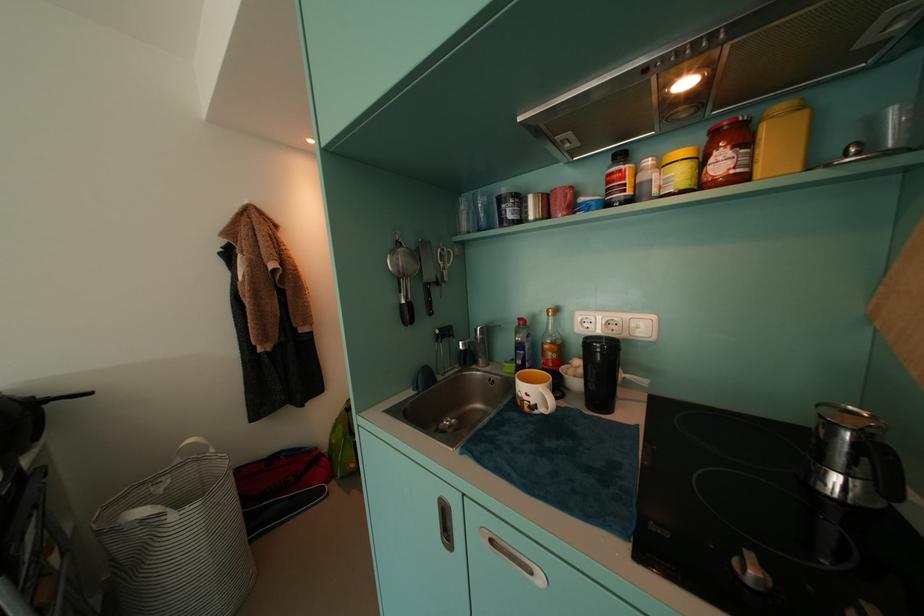
Where would you turn the stovetop control knob? Please return your answer as a coordinate pair (x, y).

(767, 519)